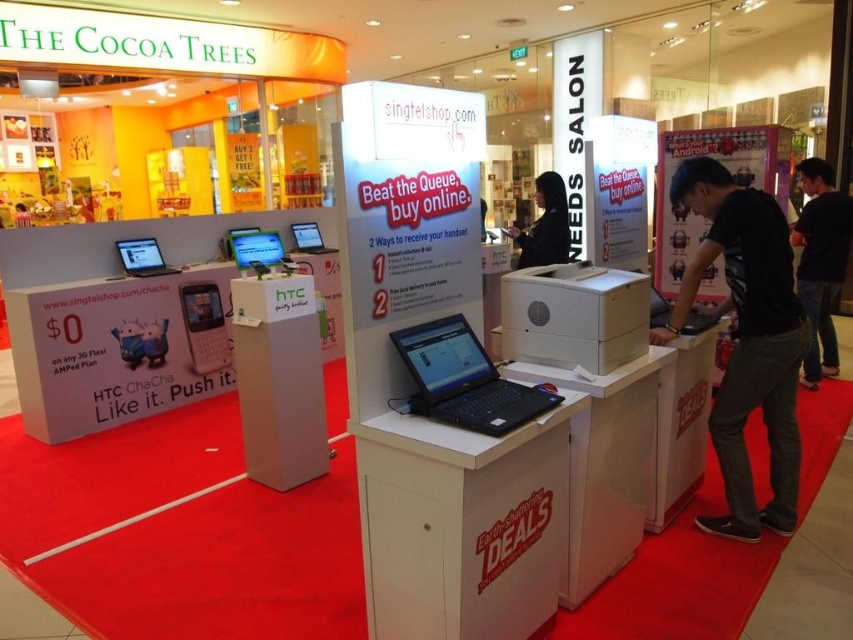
You are a customer looking to pick up an item from the kiosk. You see two laptops on the kiosk, the black glossy laptop at center and the silver metallic laptop at center. Which one is closer to you?

The black glossy laptop at center is closer to you because it is in front of the silver metallic laptop at center.

You are a customer looking to purchase a laptop. You see two laptops on the kiosk, a black glossy laptop at center and a silver metallic laptop at center. Which one is taller?

The black glossy laptop at center is taller than the silver metallic laptop at center.